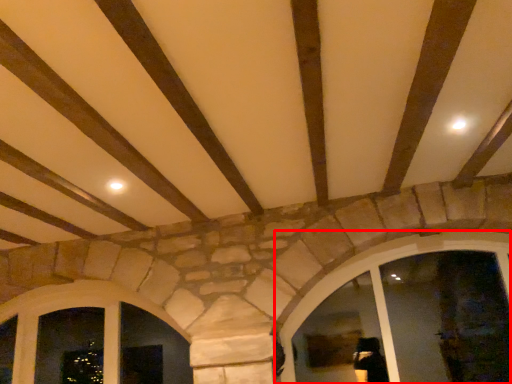
Question: From the image's perspective, where is window (annotated by the red box) located relative to window?

Choices:
 (A) above
 (B) below

Answer: (A)